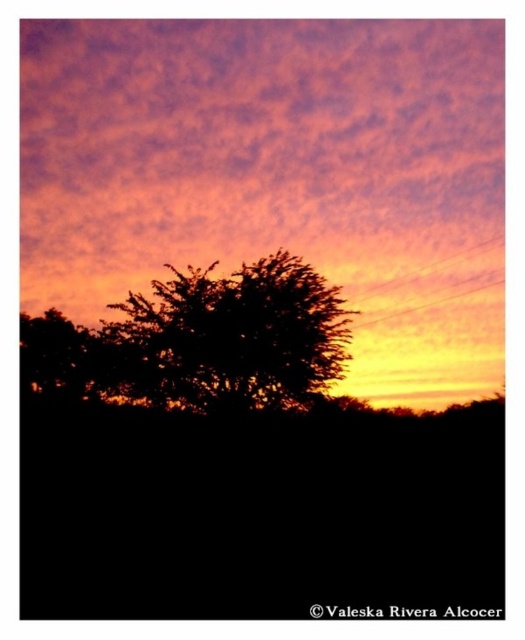
You are an astronomer observing the sunset scene. You notice two points in the sky, one at point [66,186] and the other at point [281,291]. Which point is closer to your line of sight?

Point [66,186] is further to the viewer than point [281,291], so the point at [281,291] is closer to your line of sight.

You are an astronomer observing the sunset scene. You notice the purple cloud at upper center and the silhouette tree at center. Which object is positioned to the right side of the other?

The purple cloud at upper center is to the right of the silhouette tree at center.